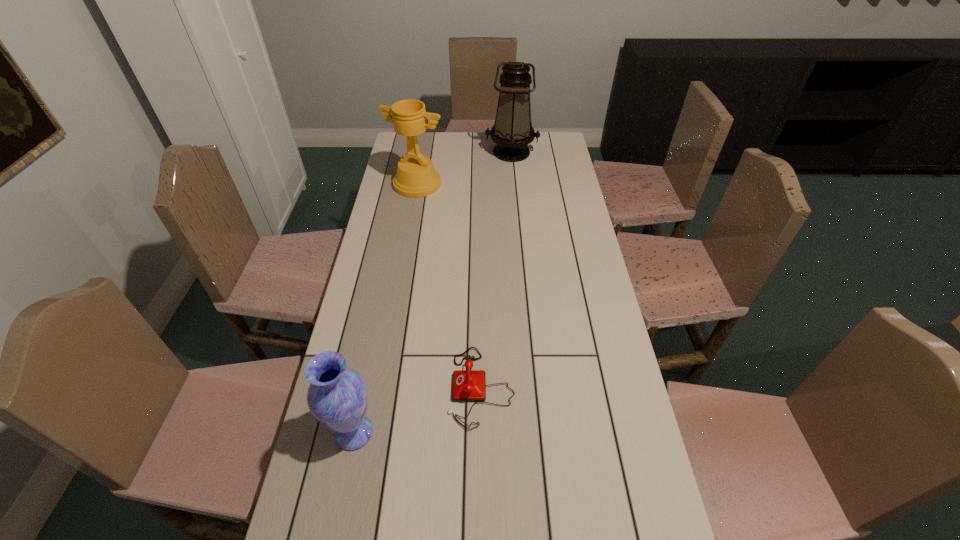
At what (x,y) coordinates should I click in order to perform the action: click on object that is the second closest to the third nearest object. Please return your answer as a coordinate pair (x, y). Looking at the image, I should click on (469, 385).

You are a GUI agent. You are given a task and a screenshot of the screen. Output one action in this format:
    pyautogui.click(x=<x>, y=<y>)
    Task: Click on the object that is the closest to the award
    The image size is (960, 540).
    Given the screenshot: What is the action you would take?
    pyautogui.click(x=512, y=131)

The image size is (960, 540). In order to click on free location that satisfies the following two spatial constraints: 1. on the back side of the vase; 2. on the right side of the second farthest object in this screenshot , I will do `click(405, 184)`.